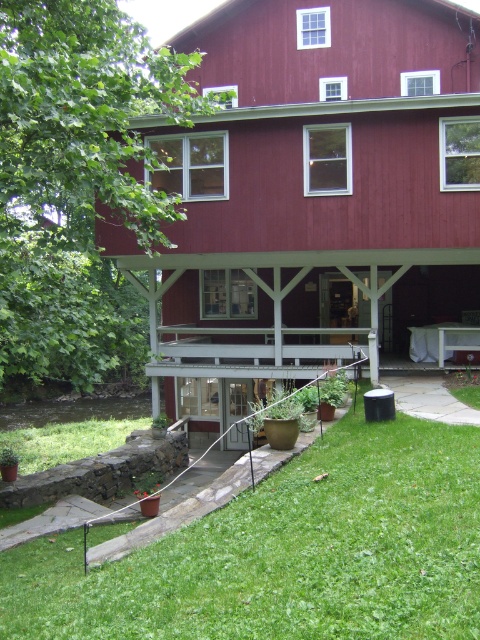
You are a landscape designer planning to install a new garden bed between the smooth red barn at center and the green grass at lower center. Considering their sizes, which object will require more space to accommodate the garden bed?

The smooth red barn at center has a larger size compared to green grass at lower center, so it will require more space to accommodate the garden bed.